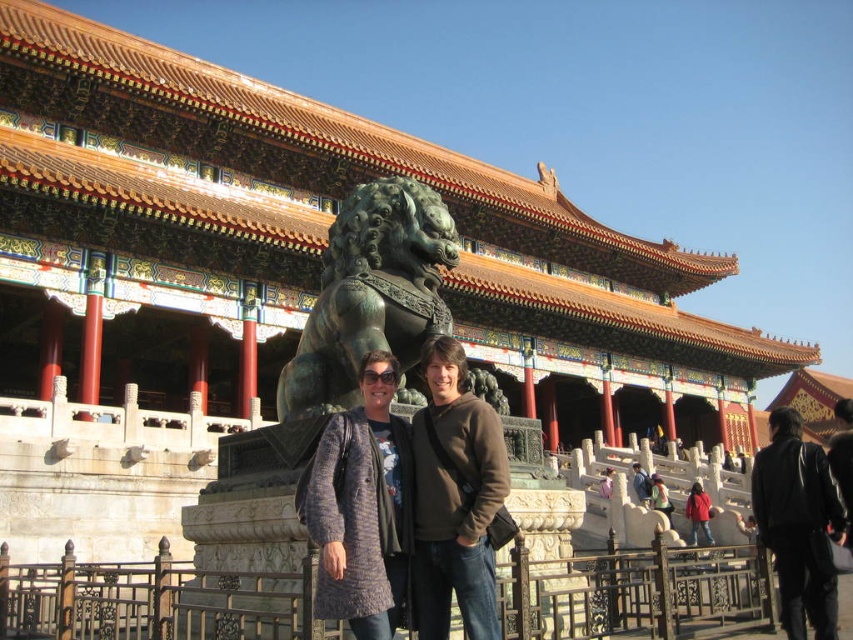
Consider the image. Can you confirm if brown metal railing at lower center is taller than knitted sweater at center?

No.

Image resolution: width=853 pixels, height=640 pixels. Find the location of `brown metal railing at lower center`. brown metal railing at lower center is located at coordinates (155, 602).

Does matte gray sweater at center appear on the right side of matte red jacket at lower right?

No, matte gray sweater at center is not to the right of matte red jacket at lower right.

Which of these two, matte gray sweater at center or matte red jacket at lower right, stands shorter?

Standing shorter between the two is matte red jacket at lower right.

Looking at this image, who is more forward, (424, 602) or (688, 515)?

Positioned in front is point (424, 602).

The height and width of the screenshot is (640, 853). I want to click on matte gray sweater at center, so click(454, 499).

Is point (492, 497) positioned behind point (843, 515)?

No, it is in front of (843, 515).

Can you confirm if matte gray sweater at center is positioned to the right of black leather jacket at lower right?

No, matte gray sweater at center is not to the right of black leather jacket at lower right.

At what (x,y) coordinates should I click in order to perform the action: click on matte gray sweater at center. Please return your answer as a coordinate pair (x, y). Looking at the image, I should click on (454, 499).